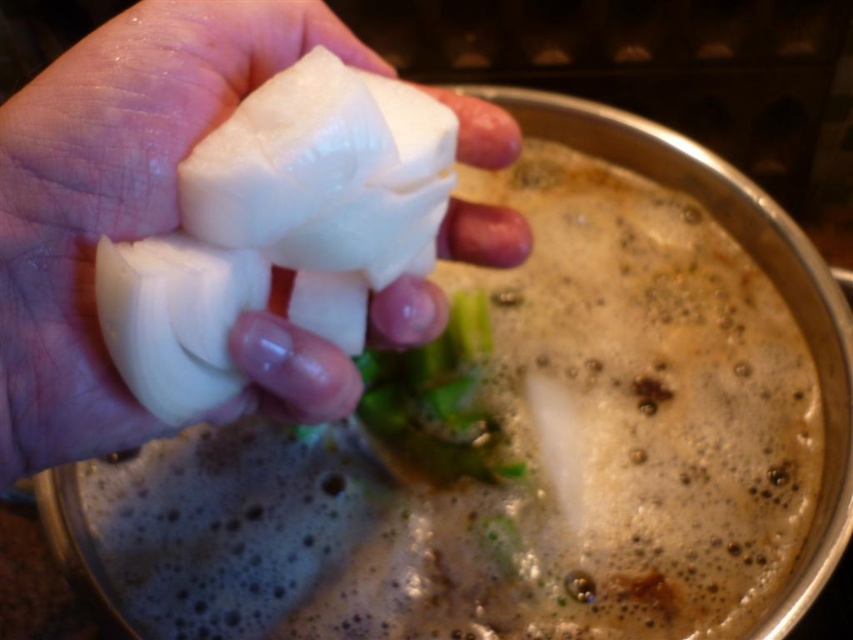
You are a chef preparing a dish and see the white matte onion at center and the green leafy at center in the scene. Which one is closer to you?

The white matte onion at center is closer to you because it is in front of the green leafy at center.